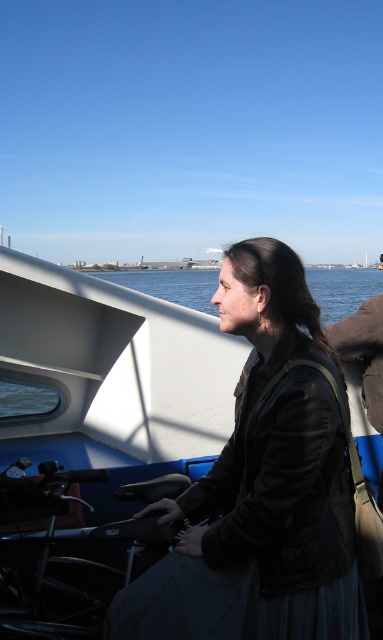
Question: Is white matte boat at center above blue water at upper center?

Choices:
 (A) yes
 (B) no

Answer: (B)

Question: Is the position of white matte boat at center more distant than that of blue water at upper center?

Choices:
 (A) yes
 (B) no

Answer: (B)

Question: Which of the following is the farthest from the observer?

Choices:
 (A) white matte boat at center
 (B) blue water at upper center

Answer: (B)

Question: Which point is closer to the camera?

Choices:
 (A) (325, 284)
 (B) (37, 365)

Answer: (B)

Question: Which of the following is the farthest from the observer?

Choices:
 (A) blue water at upper center
 (B) white matte boat at center

Answer: (A)

Question: Is white matte boat at center further to the viewer compared to blue water at upper center?

Choices:
 (A) no
 (B) yes

Answer: (A)